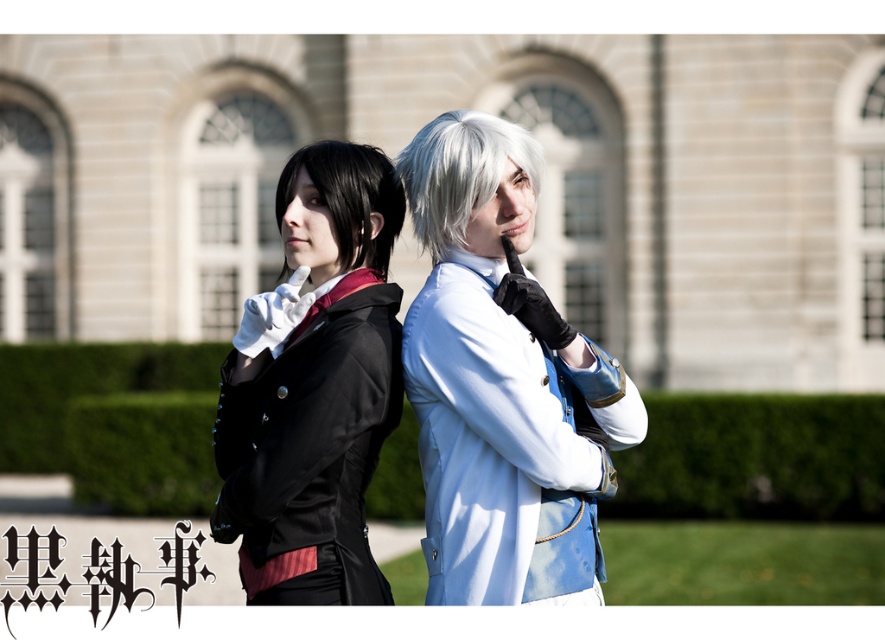
Does point (532, 209) come closer to viewer compared to point (335, 196)?

No.

This screenshot has height=640, width=885. In order to click on satin white wig at center in this screenshot , I will do `click(502, 381)`.

You are a GUI agent. You are given a task and a screenshot of the screen. Output one action in this format:
    pyautogui.click(x=<x>, y=<y>)
    Task: Click on the satin white wig at center
    
    Given the screenshot: What is the action you would take?
    pyautogui.click(x=502, y=381)

Does white silky hair at center appear on the right side of shiny black hair at left?

Correct, you'll find white silky hair at center to the right of shiny black hair at left.

Is white silky hair at center taller than shiny black hair at left?

No, white silky hair at center is not taller than shiny black hair at left.

The image size is (885, 640). What do you see at coordinates (462, 173) in the screenshot?
I see `white silky hair at center` at bounding box center [462, 173].

Identify the location of white silky hair at center. (462, 173).

Is matte black coat at left bigger than shiny black hair at left?

Incorrect, matte black coat at left is not larger than shiny black hair at left.

Locate an element on the screen. This screenshot has height=640, width=885. matte black coat at left is located at coordinates (314, 388).